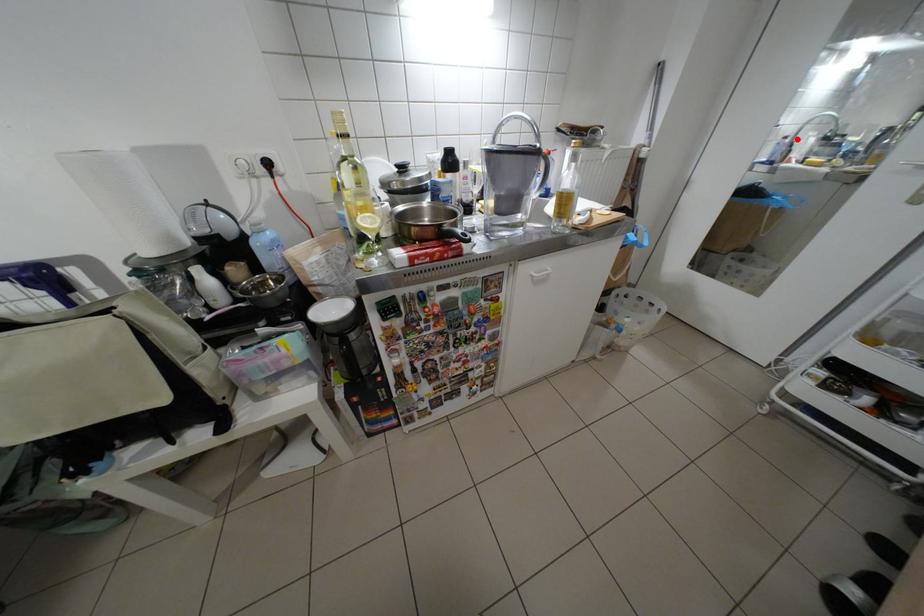
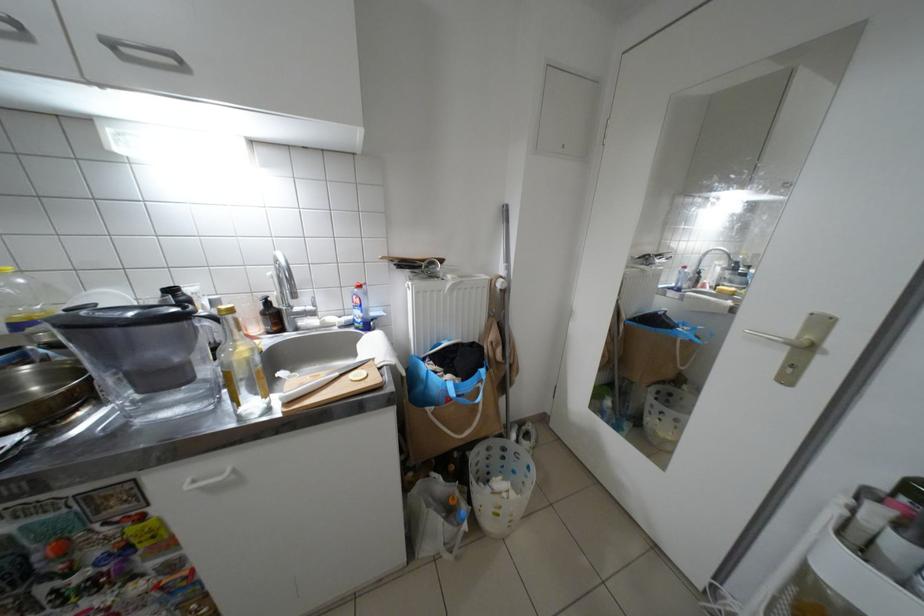
Find the pixel in the second image that matches the highlighted location in the first image.

(697, 269)